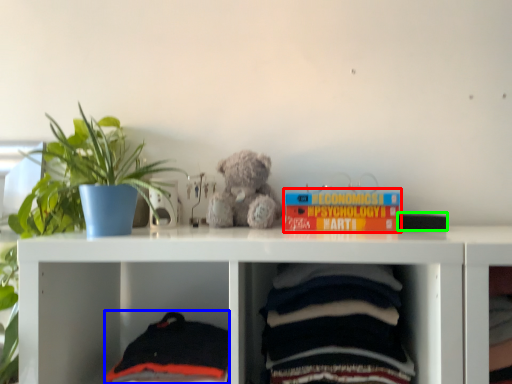
Question: Which is farther away from book (highlighted by a red box)? baby clothe (highlighted by a blue box) or book (highlighted by a green box)?

Choices:
 (A) baby clothe
 (B) book

Answer: (A)